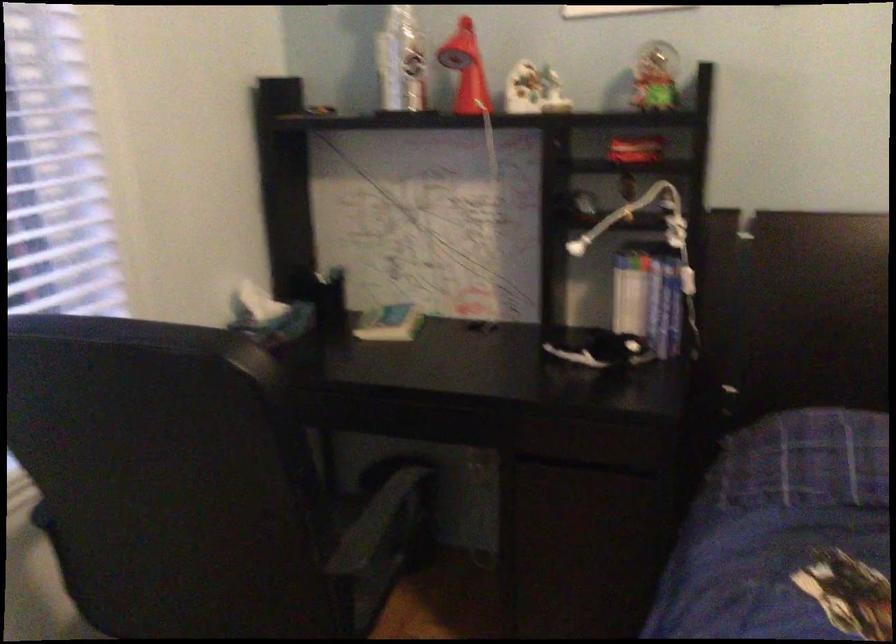
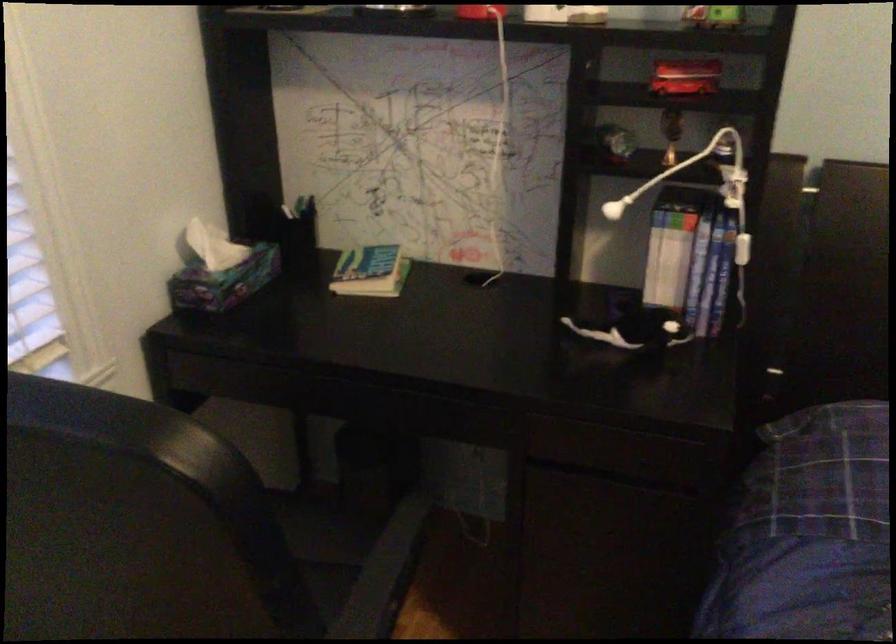
Locate, in the second image, the point that corresponds to (636,146) in the first image.

(685, 77)